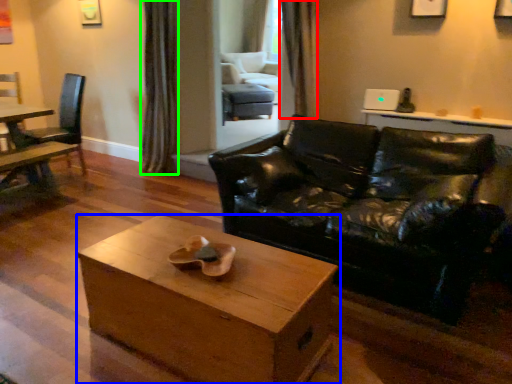
Question: Which is farther away from curtain (highlighted by a red box)? coffee table (highlighted by a blue box) or curtain (highlighted by a green box)?

Choices:
 (A) coffee table
 (B) curtain

Answer: (A)